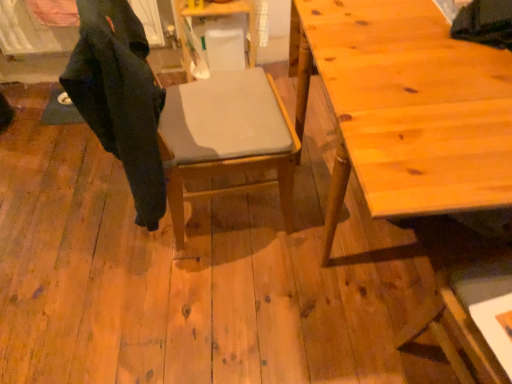
This screenshot has width=512, height=384. Identify the location of free space in front of matte gray cushion at center. (206, 297).